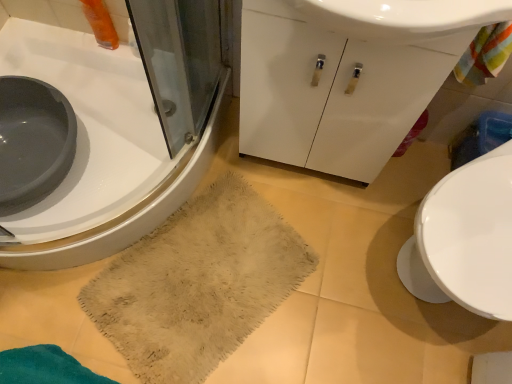
Find the location of a particular element. The height and width of the screenshot is (384, 512). vacant region above beige fuzzy rug at lower center (from a real-world perspective) is located at coordinates (181, 286).